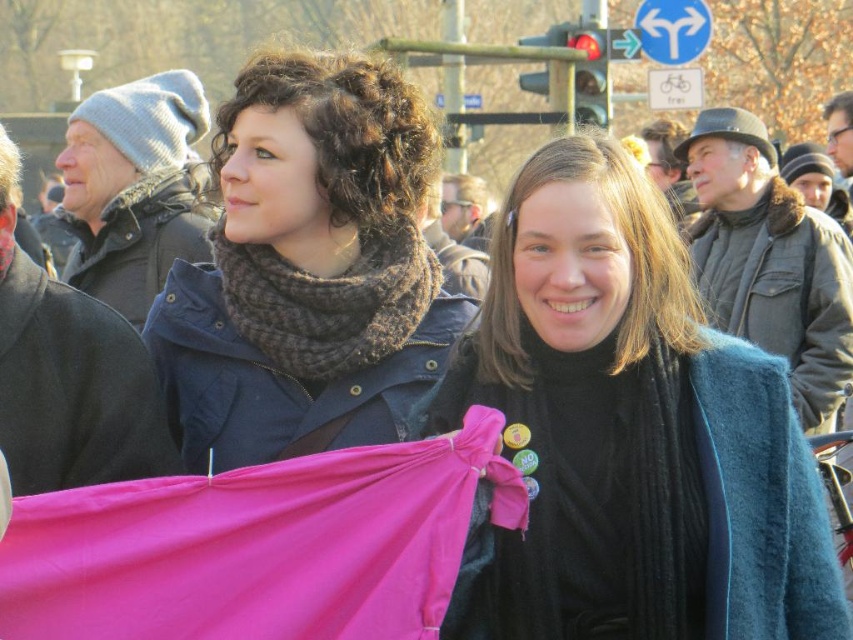
You are a photographer trying to capture a closeup of the velvet teal coat at center and the knitted wool scarf at center. Which object should you zoom in on first to ensure it appears larger in your photo?

The knitted wool scarf at center is taller than the velvet teal coat at center, so you should zoom in on the knitted wool scarf at center first to ensure it appears larger in the photo.

You are a photographer trying to capture the velvet teal coat at center in your shot. Based on the scene description, where should you position your camera to ensure the coat is in the frame?

The velvet teal coat at center is located at point (631, 432), so positioning the camera to focus on that coordinate will ensure the coat is centered in the frame.

You are an organizer at the event and need to decide which item to place in a narrow display case. The velvet teal coat at center and the knitted wool scarf at center are both candidates. Based on their thickness, which item is more suitable for the narrow case?

The velvet teal coat at center is thinner than the knitted wool scarf at center, so it is more suitable for the narrow display case.